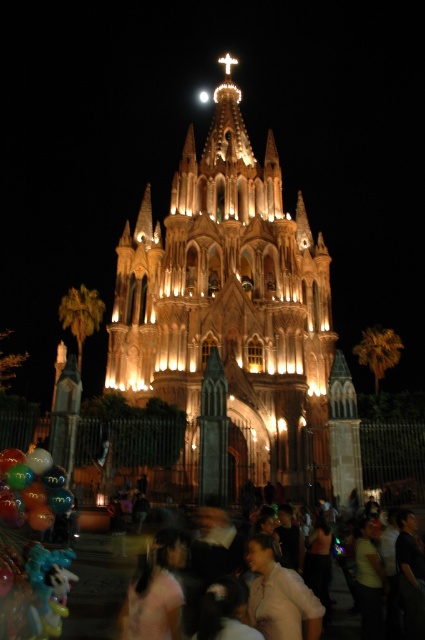
Question: Which object appears closest to the camera in this image?

Choices:
 (A) illuminated stone tower at center
 (B) translucent glossy balloons at lower left

Answer: (B)

Question: Does light pink fabric at center have a lesser width compared to blurred people at lower center?

Choices:
 (A) no
 (B) yes

Answer: (B)

Question: Which object is farther from the camera taking this photo?

Choices:
 (A) light pink fabric at center
 (B) illuminated stone tower at center

Answer: (B)

Question: Is the position of light pink fabric at center less distant than that of blurred people at lower center?

Choices:
 (A) yes
 (B) no

Answer: (A)

Question: Which of the following is the closest to the observer?

Choices:
 (A) (391, 637)
 (B) (295, 586)
 (C) (20, 468)

Answer: (B)

Question: Does illuminated stone tower at center lie behind blurred people at lower center?

Choices:
 (A) yes
 (B) no

Answer: (A)